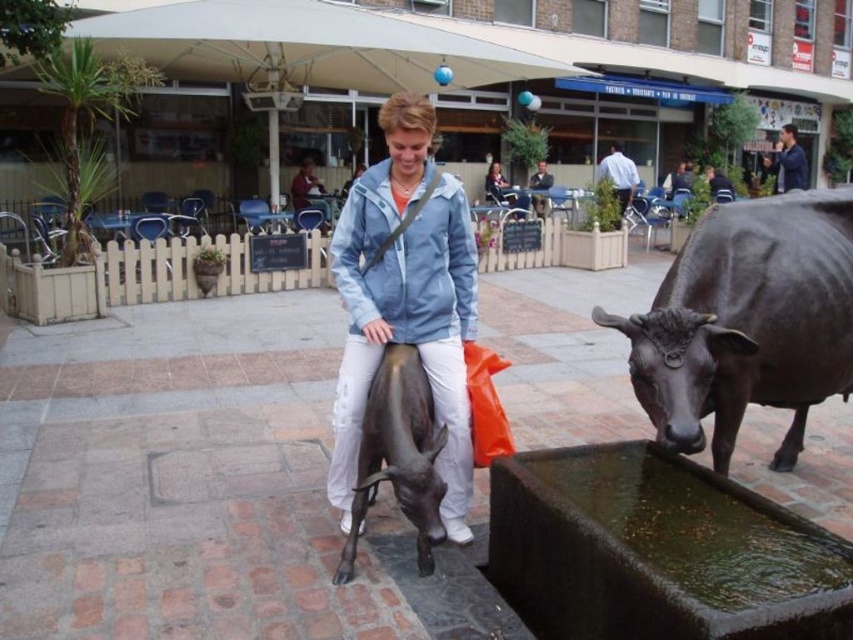
You are a photographer setting up a tripod in the plaza. You need to position it between the matte blue jacket at center and the bronze statue at center so that it doesn

The matte blue jacket at center is wider than the bronze statue at center, so positioning the tripod between them would require placing it closer to the bronze statue at center to ensure enough space for both objects.

You are a tour guide leading a group of visitors. You want to ensure everyone can see the bronze statue at center clearly. The shiny dark brown bull at right is blocking the view for some people. How far apart are these two attractions?

The shiny dark brown bull at right is 3.96 feet away from the bronze statue at center. To ensure clear visibility, you might consider moving closer to the bronze statue at center or around the shiny dark brown bull at right.

You are standing in the plaza and want to take a photo of both the shiny dark brown bull at right and the matte blue jacket at center. Since you want both subjects in focus, which one should you position closer to the camera to ensure both are sharp?

To ensure both the shiny dark brown bull at right and the matte blue jacket at center are in focus, position the shiny dark brown bull at right closer to the camera since it is already nearer to the viewer than the matte blue jacket at center. This way, the depth of field can cover both subjects effectively.